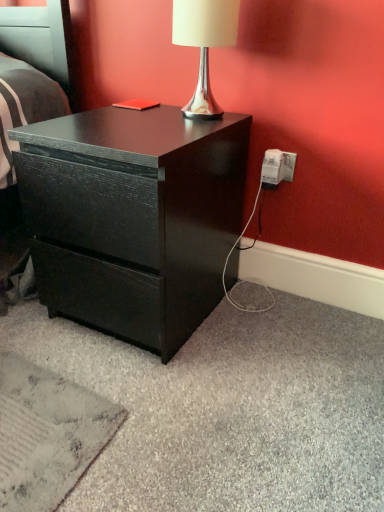
Question: From a real-world perspective, is matte black drawer at center above or below white plastic power outlet at lower right?

Choices:
 (A) above
 (B) below

Answer: (B)

Question: From their relative heights in the image, would you say matte black drawer at center is taller or shorter than white plastic power outlet at lower right?

Choices:
 (A) tall
 (B) short

Answer: (A)

Question: Based on their relative distances, which object is nearer to the white plastic power outlet at lower right?

Choices:
 (A) silver metallic lamp at upper center
 (B) matte black drawer at center

Answer: (A)

Question: Which is nearer to the white plastic power outlet at lower right?

Choices:
 (A) silver metallic lamp at upper center
 (B) matte black drawer at center

Answer: (A)